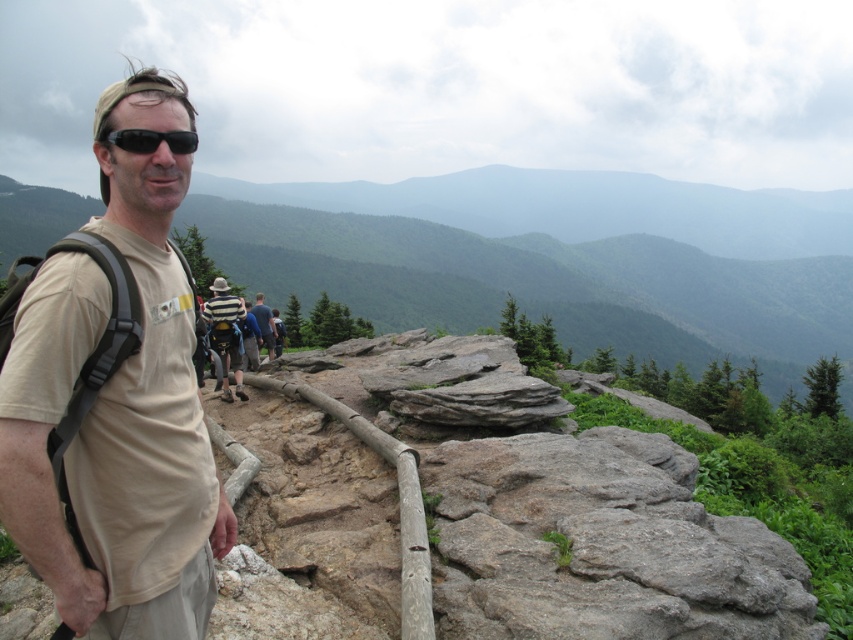
Is tan fabric shirt at left shorter than black matte sunglasses at center?

No.

Can you confirm if tan fabric shirt at left is smaller than black matte sunglasses at center?

No.

Where is `tan fabric shirt at left`? This screenshot has width=853, height=640. tan fabric shirt at left is located at coordinates (119, 404).

Which of these two, striped cotton shirt at center or black matte sunglasses at center, stands taller?

striped cotton shirt at center is taller.

Which is above, striped cotton shirt at center or black matte sunglasses at center?

black matte sunglasses at center

Does point (216, 342) come closer to viewer compared to point (193, 141)?

No, it is not.

Where is `striped cotton shirt at center`? striped cotton shirt at center is located at coordinates (225, 333).

Looking at this image, can you confirm if tan fabric shirt at left is positioned above blue striped shirt at center?

Yes.

Who is shorter, tan fabric shirt at left or blue striped shirt at center?

Standing shorter between the two is blue striped shirt at center.

At what (x,y) coordinates should I click in order to perform the action: click on tan fabric shirt at left. Please return your answer as a coordinate pair (x, y). Image resolution: width=853 pixels, height=640 pixels. Looking at the image, I should click on pos(119,404).